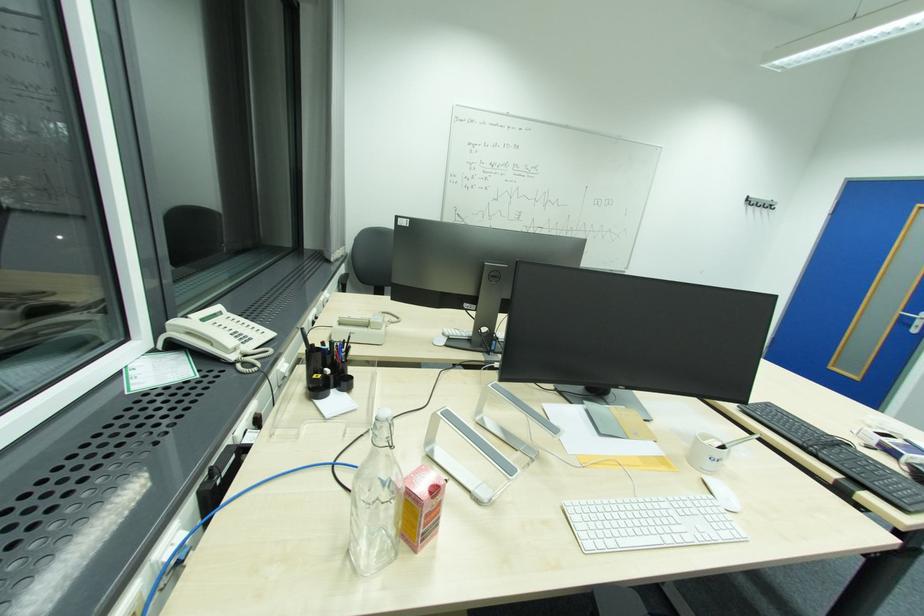
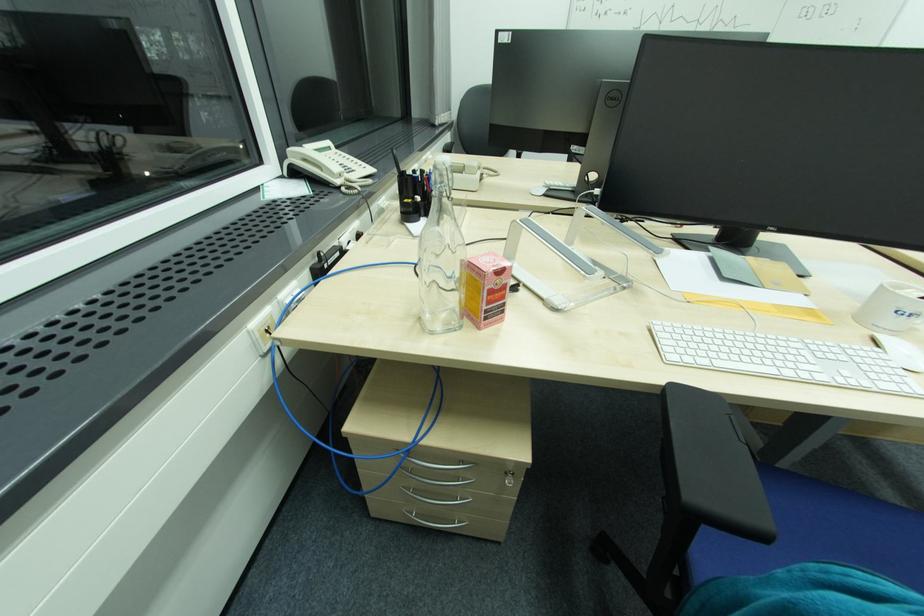
The first image is from the beginning of the video and the second image is from the end. How did the camera likely rotate when shooting the video?

The camera's rotation is toward left-down.